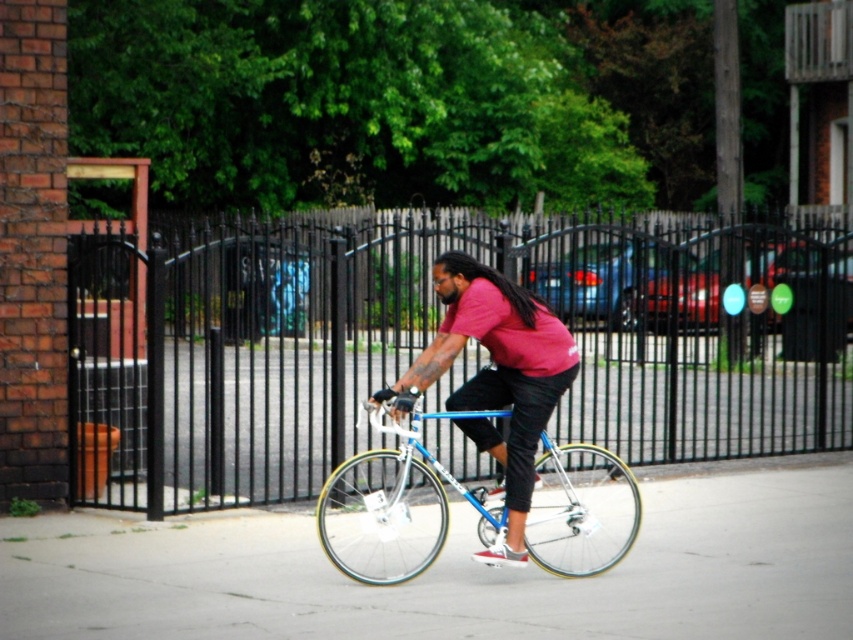
This screenshot has width=853, height=640. Describe the element at coordinates (426, 342) in the screenshot. I see `black metal fence at center` at that location.

Can you confirm if black metal fence at center is thinner than gray concrete pavement at center?

Incorrect, black metal fence at center's width is not less than gray concrete pavement at center's.

Is point (228, 221) positioned after point (146, 529)?

Yes, point (228, 221) is farther from viewer.

Where is `black metal fence at center`? This screenshot has height=640, width=853. black metal fence at center is located at coordinates (426, 342).

Can you confirm if gray concrete pavement at center is positioned above blue metallic bicycle at center?

Incorrect, gray concrete pavement at center is not positioned above blue metallic bicycle at center.

Who is more forward, (437, 634) or (479, 493)?

Positioned in front is point (437, 634).

Identify the location of gray concrete pavement at center. Image resolution: width=853 pixels, height=640 pixels. (454, 570).

Between blue metallic bicycle at center and matte blue bicycle at center, which one appears on the left side from the viewer's perspective?

matte blue bicycle at center

I want to click on blue metallic bicycle at center, so click(x=397, y=508).

Between point (368, 522) and point (428, 362), which one is positioned behind?

The point (368, 522) is behind.

At what (x,y) coordinates should I click in order to perform the action: click on blue metallic bicycle at center. Please return your answer as a coordinate pair (x, y). This screenshot has height=640, width=853. Looking at the image, I should click on (397, 508).